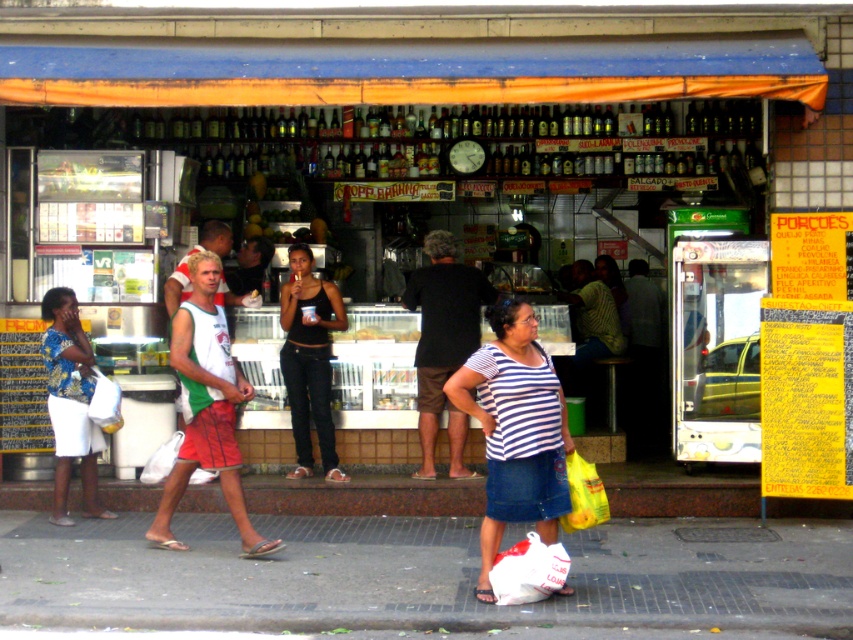
Question: Is black matte tank top at center in front of printed fabric skirt at lower left?

Choices:
 (A) yes
 (B) no

Answer: (B)

Question: Is black matte tank top at center to the left of printed fabric skirt at lower left from the viewer's perspective?

Choices:
 (A) no
 (B) yes

Answer: (A)

Question: Considering the real-world distances, which object is closest to the printed fabric skirt at lower left?

Choices:
 (A) striped cotton shirt at center
 (B) black matte tank top at center
 (C) smooth concrete pavement at lower center

Answer: (B)

Question: Is smooth concrete pavement at lower center smaller than black matte tank top at center?

Choices:
 (A) yes
 (B) no

Answer: (A)

Question: Which point is closer to the camera taking this photo?

Choices:
 (A) (70, 312)
 (B) (345, 536)
 (C) (309, 454)
 (D) (527, 376)

Answer: (D)

Question: Which point is closer to the camera taking this photo?

Choices:
 (A) (202, 545)
 (B) (73, 435)
 (C) (537, 456)

Answer: (C)